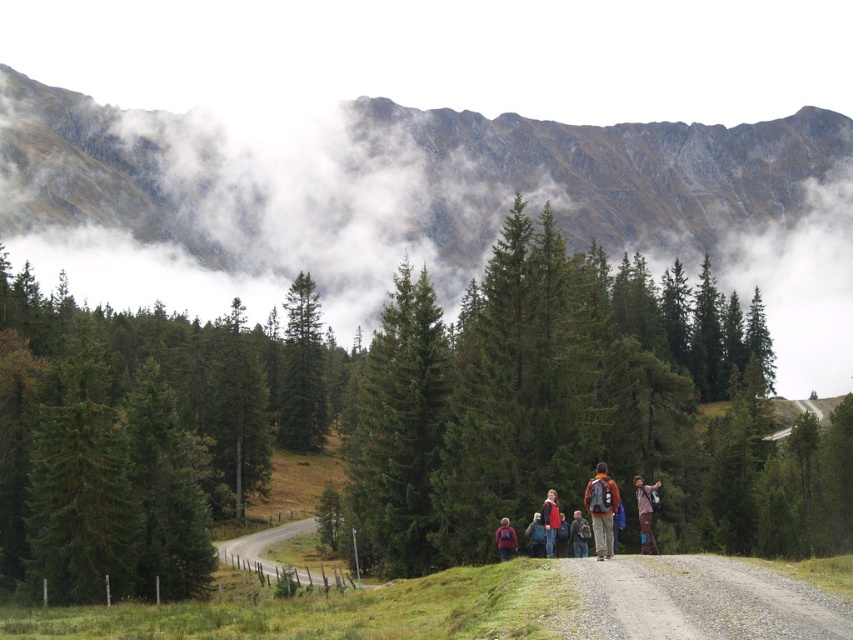
Which is in front, point (583, 545) or point (537, 545)?

Point (583, 545) is in front.

Can you confirm if dark gray backpack at center is positioned to the left of dark blue jacket at center?

No, dark gray backpack at center is not to the left of dark blue jacket at center.

Which is behind, point (582, 529) or point (544, 548)?

Point (544, 548)

Locate an element on the screen. This screenshot has height=640, width=853. dark gray backpack at center is located at coordinates (579, 534).

Is gravelly dirt road at center below orange fabric backpack at center?

Correct, gravelly dirt road at center is located below orange fabric backpack at center.

Between point (660, 572) and point (604, 474), which one is positioned behind?

Point (604, 474)

Locate an element on the screen. gravelly dirt road at center is located at coordinates (698, 600).

Can you confirm if gravel road at lower left is bigger than orange fabric backpack at center?

Correct, gravel road at lower left is larger in size than orange fabric backpack at center.

Is gravel road at lower left wider than orange fabric backpack at center?

Yes, gravel road at lower left is wider than orange fabric backpack at center.

What are the coordinates of `gravel road at lower left` in the screenshot? It's located at (260, 545).

You are a GUI agent. You are given a task and a screenshot of the screen. Output one action in this format:
    pyautogui.click(x=<x>, y=<y>)
    Task: Click on the gravel road at lower left
    Image resolution: width=853 pixels, height=640 pixels.
    Given the screenshot: What is the action you would take?
    click(x=260, y=545)